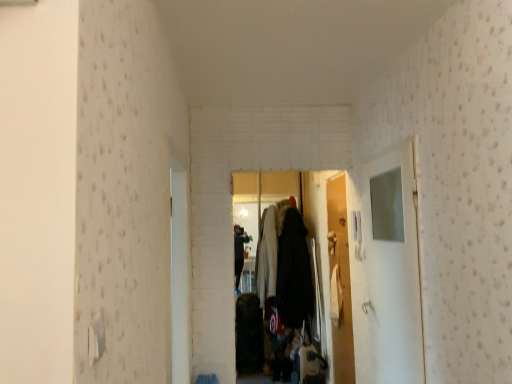
Question: Is point (347, 235) closer or farther from the camera than point (411, 261)?

Choices:
 (A) closer
 (B) farther

Answer: (B)

Question: In terms of width, does white glossy door at center, the second door in the front-to-back sequence, look wider or thinner when compared to transparent glass door at right?

Choices:
 (A) thin
 (B) wide

Answer: (A)

Question: Which is nearer to the white glossy door at center, the first door in the front-to-back sequence?

Choices:
 (A) transparent glass door at right
 (B) white glossy door at center, acting as the second door starting from the left

Answer: (A)

Question: Considering the real-world distances, which object is closest to the transparent glass door at right?

Choices:
 (A) white glossy door at center, which ranks as the 1th door in right-to-left order
 (B) white glossy door at center, which appears as the first door when viewed from the left

Answer: (A)